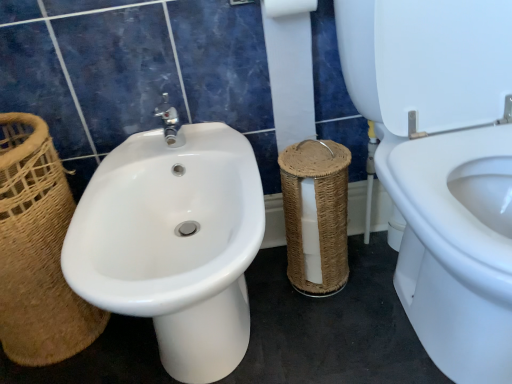
In order to click on free spot in front of woven brown basket at center in this screenshot , I will do `click(338, 326)`.